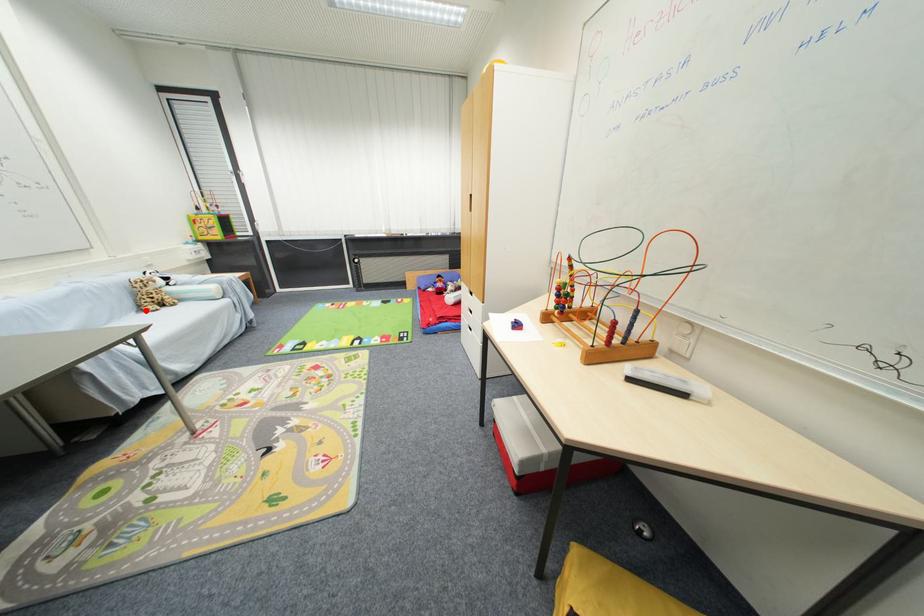
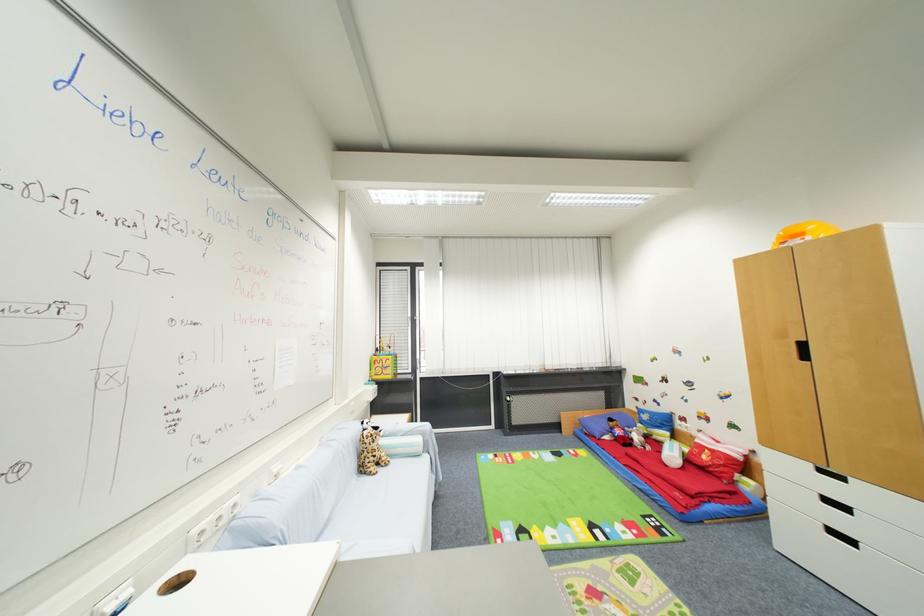
Locate, in the second image, the point that corresponds to the highlighted location in the first image.

(367, 472)